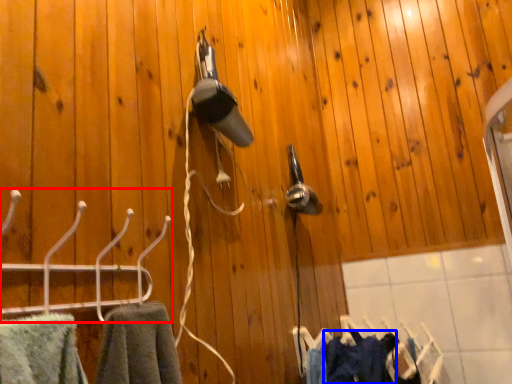
Question: Which of the following is the farthest to the observer, hanger (highlighted by a red box) or clothing (highlighted by a blue box)?

Choices:
 (A) hanger
 (B) clothing

Answer: (B)